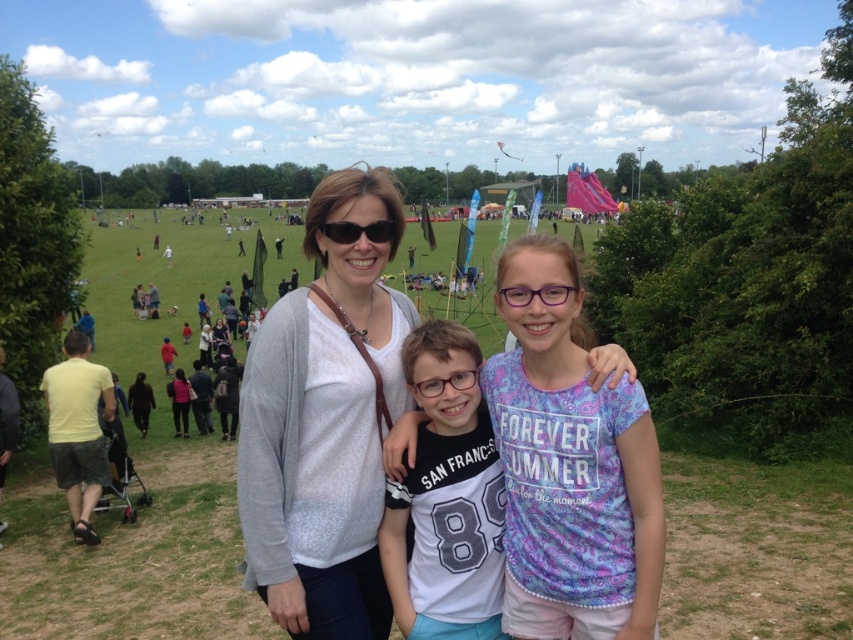
You are a photographer at the event and need to ensure all items are visible in your photo. The gray sweater at center and the black plastic sunglasses at center are both in the frame. Which item should you focus on to capture both clearly?

The gray sweater at center is much taller than the black plastic sunglasses at center, so focusing on the gray sweater at center will ensure both items are in clear view.

You are a photographer at the event and want to take a photo of the purple plastic glasses at center. Where should you position your camera to capture the glasses clearly?

You should position your camera directly facing the purple plastic glasses at center located at point [535,294] to capture them clearly.